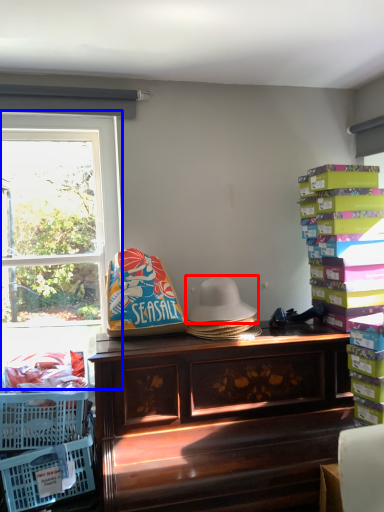
Question: Which point is further to the camera, hat (highlighted by a red box) or window (highlighted by a blue box)?

Choices:
 (A) hat
 (B) window

Answer: (B)